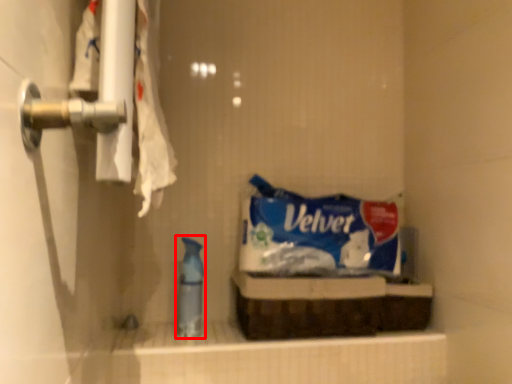
Question: From the image's perspective, what is the correct spatial relationship of cleaning product (annotated by the red box) in relation to snack?

Choices:
 (A) above
 (B) below

Answer: (B)